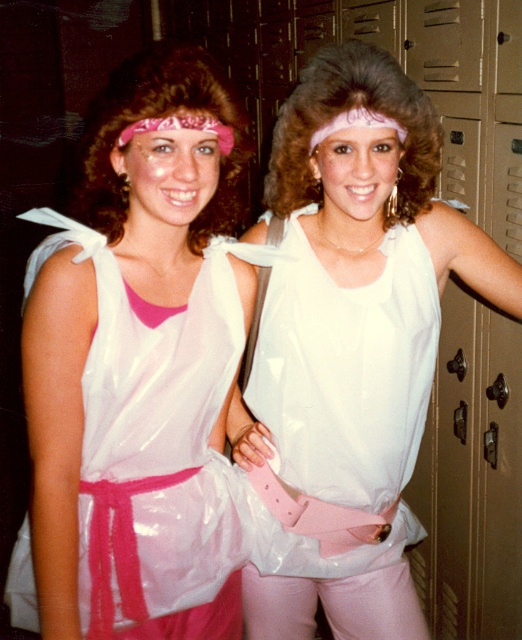
Is point (69, 532) less distant than point (395, 516)?

Yes, point (69, 532) is in front of point (395, 516).

Locate an element on the screen. matte plastic toga at center is located at coordinates click(137, 368).

Measure the distance between point (180, 317) and camera.

A distance of 3.55 feet exists between point (180, 317) and camera.

I want to click on matte plastic toga at center, so click(x=137, y=368).

Does matte white tank top at center have a smaller size compared to white glossy dress at center?

No.

Which is behind, point (407, 188) or point (316, 332)?

The point (407, 188) is more distant.

This screenshot has width=522, height=640. In order to click on matte white tank top at center in this screenshot , I will do `click(351, 330)`.

Is matte plastic toga at center above white glossy dress at center?

Indeed, matte plastic toga at center is positioned over white glossy dress at center.

Between matte plastic toga at center and white glossy dress at center, which one is positioned higher?

Positioned higher is matte plastic toga at center.

This screenshot has height=640, width=522. What do you see at coordinates (137, 368) in the screenshot?
I see `matte plastic toga at center` at bounding box center [137, 368].

Find the location of a particular element. The height and width of the screenshot is (640, 522). matte plastic toga at center is located at coordinates (137, 368).